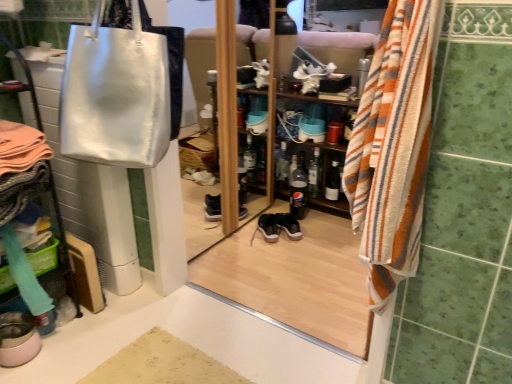
Identify the location of empty space that is to the right of beige textured bath mat at lower center. This screenshot has height=384, width=512. (261, 355).